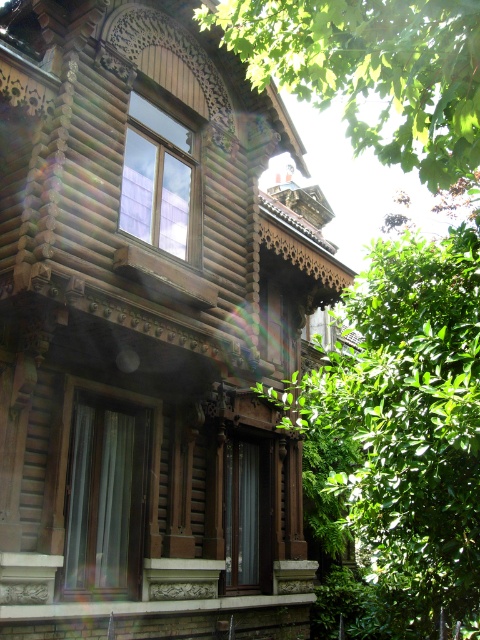
Question: Which of the following is the closest to the observer?

Choices:
 (A) (228, 13)
 (B) (156, 116)
 (C) (123, 497)

Answer: (A)

Question: Can you confirm if green leafy tree at upper center is thinner than transparent glass window at upper center?

Choices:
 (A) yes
 (B) no

Answer: (A)

Question: Which object is farther from the camera taking this photo?

Choices:
 (A) transparent glass window at upper center
 (B) green leafy tree at center
 (C) green leafy tree at upper center

Answer: (A)

Question: Considering the relative positions of green leafy tree at upper center and transparent glass window at upper center in the image provided, where is green leafy tree at upper center located with respect to transparent glass window at upper center?

Choices:
 (A) right
 (B) left

Answer: (A)

Question: Which of the following is the farthest from the observer?

Choices:
 (A) pyautogui.click(x=420, y=376)
 (B) pyautogui.click(x=137, y=228)
 (C) pyautogui.click(x=375, y=154)
 (D) pyautogui.click(x=101, y=573)

Answer: (C)

Question: Is green leafy tree at center positioned in front of green leafy tree at upper center?

Choices:
 (A) yes
 (B) no

Answer: (A)